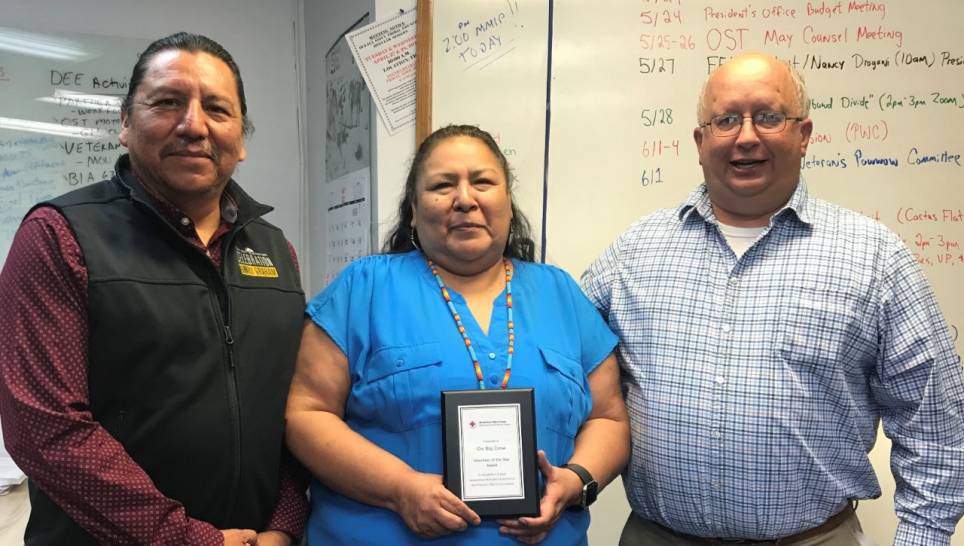
At what (x,y) coordinates should I click in order to perform the action: click on award plaque. Please return your answer as a coordinate pair (x, y). This screenshot has width=964, height=546. Looking at the image, I should click on (488, 445).